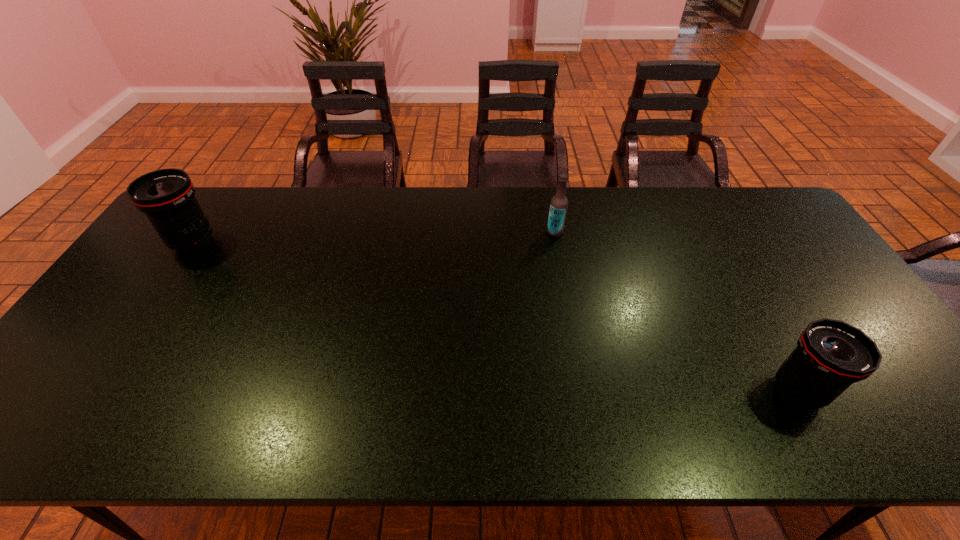
This screenshot has height=540, width=960. I want to click on telephoto lens located at the far edge, so click(x=167, y=197).

Find the location of a particular element. The height and width of the screenshot is (540, 960). beer bottle situated at the far edge is located at coordinates (558, 207).

At what (x,y) coordinates should I click in order to perform the action: click on object at the near edge. Please return your answer as a coordinate pair (x, y). Looking at the image, I should click on (831, 355).

The width and height of the screenshot is (960, 540). Find the location of `object present at the left edge`. object present at the left edge is located at coordinates (167, 197).

I want to click on object present at the far left corner, so click(x=167, y=197).

Identify the location of vacant space at the far edge of the desktop. This screenshot has height=540, width=960. (681, 207).

The image size is (960, 540). In the image, there is a desktop. Identify the location of vacant region at the near edge. (415, 425).

Find the location of a particular element. vacant space at the left edge of the desktop is located at coordinates (79, 406).

I want to click on vacant space at the right edge, so click(805, 298).

In the image, there is a desktop. Identify the location of vacant space at the far left corner. Image resolution: width=960 pixels, height=540 pixels. (216, 214).